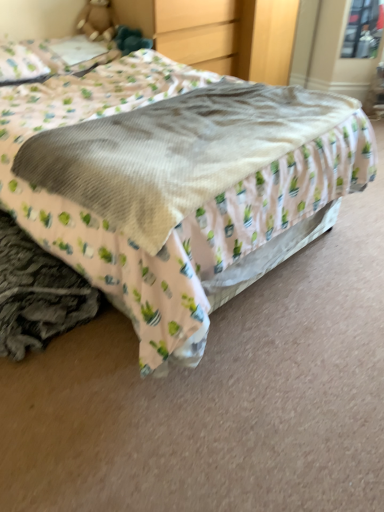
Question: Is transparent glass window at upper right at the left side of matte wood dresser at upper center?

Choices:
 (A) no
 (B) yes

Answer: (A)

Question: Considering the relative sizes of transparent glass window at upper right and matte wood dresser at upper center in the image provided, is transparent glass window at upper right taller than matte wood dresser at upper center?

Choices:
 (A) no
 (B) yes

Answer: (A)

Question: Considering the relative positions of transparent glass window at upper right and matte wood dresser at upper center in the image provided, is transparent glass window at upper right behind matte wood dresser at upper center?

Choices:
 (A) yes
 (B) no

Answer: (A)

Question: Does transparent glass window at upper right lie in front of matte wood dresser at upper center?

Choices:
 (A) yes
 (B) no

Answer: (B)

Question: Can you confirm if transparent glass window at upper right is thinner than matte wood dresser at upper center?

Choices:
 (A) yes
 (B) no

Answer: (A)

Question: Considering the relative sizes of transparent glass window at upper right and matte wood dresser at upper center in the image provided, is transparent glass window at upper right bigger than matte wood dresser at upper center?

Choices:
 (A) no
 (B) yes

Answer: (A)

Question: From a real-world perspective, is soft beige blanket at center below transparent glass window at upper right?

Choices:
 (A) yes
 (B) no

Answer: (A)

Question: Does soft beige blanket at center come behind transparent glass window at upper right?

Choices:
 (A) no
 (B) yes

Answer: (A)

Question: Is soft beige blanket at center to the left of transparent glass window at upper right from the viewer's perspective?

Choices:
 (A) no
 (B) yes

Answer: (B)

Question: From a real-world perspective, is soft beige blanket at center positioned over transparent glass window at upper right based on gravity?

Choices:
 (A) no
 (B) yes

Answer: (A)

Question: From the image's perspective, is soft beige blanket at center over transparent glass window at upper right?

Choices:
 (A) no
 (B) yes

Answer: (A)

Question: Can you confirm if soft beige blanket at center is thinner than transparent glass window at upper right?

Choices:
 (A) no
 (B) yes

Answer: (A)

Question: Is there a large distance between white fabric pillow at upper left and soft beige blanket at center?

Choices:
 (A) yes
 (B) no

Answer: (A)